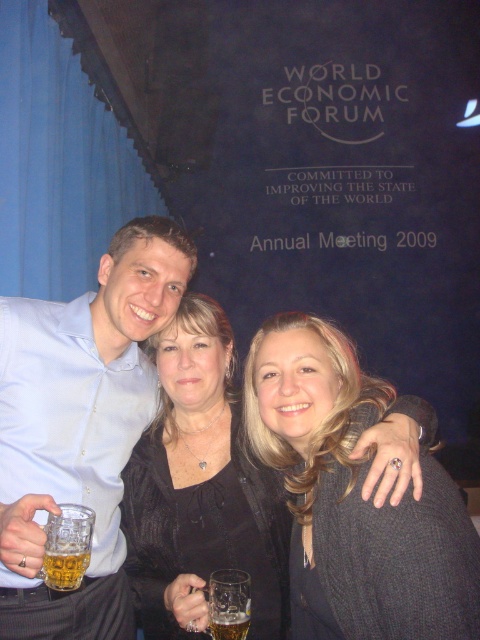
Question: Among these objects, which one is nearest to the camera?

Choices:
 (A) black fabric at center
 (B) translucent glass beer at lower center
 (C) translucent glass mug at lower left

Answer: (C)

Question: Which point is farther to the camera?

Choices:
 (A) dark gray sweater at center
 (B) matte black dress at center

Answer: (B)

Question: Where is matte black dress at center located in relation to black fabric at center in the image?

Choices:
 (A) right
 (B) left

Answer: (B)

Question: Can you confirm if matte black dress at center is positioned above translucent glass mug at lower left?

Choices:
 (A) no
 (B) yes

Answer: (B)

Question: Which object is positioned farthest from the black fabric at center?

Choices:
 (A) dark gray sweater at center
 (B) matte blue shirt at center
 (C) translucent glass beer at lower center

Answer: (C)

Question: Is matte black dress at center wider than dark gray sweater at center?

Choices:
 (A) no
 (B) yes

Answer: (B)